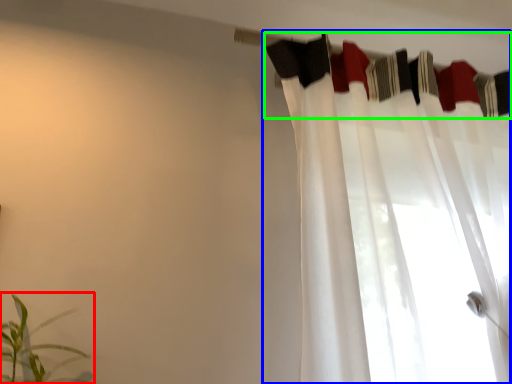
Question: Which object is the farthest from houseplant (highlighted by a red box)? Choose among these: curtain (highlighted by a blue box) or clothesline (highlighted by a green box).

Choices:
 (A) curtain
 (B) clothesline

Answer: (B)